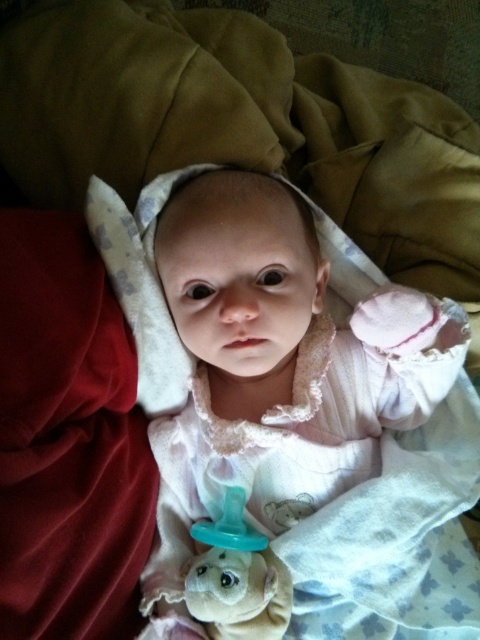
Question: Considering the relative positions of white soft baby at center and teal rubber pacifier at center in the image provided, where is white soft baby at center located with respect to teal rubber pacifier at center?

Choices:
 (A) left
 (B) right

Answer: (B)

Question: In this image, where is white soft baby at center located relative to teal rubber pacifier at center?

Choices:
 (A) above
 (B) below

Answer: (A)

Question: Which of the following is the farthest from the observer?

Choices:
 (A) (268, 561)
 (B) (189, 548)

Answer: (B)

Question: Is white soft baby at center above teal rubber pacifier at center?

Choices:
 (A) yes
 (B) no

Answer: (A)